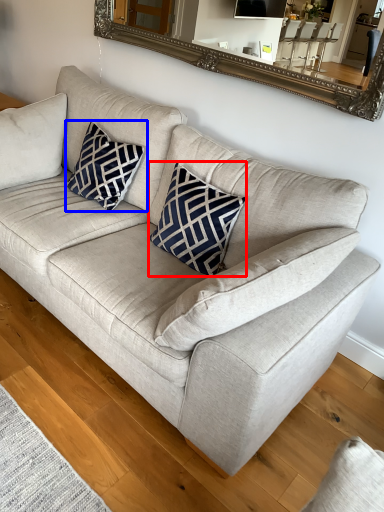
Question: Which object is closer to the camera taking this photo, throw pillow (highlighted by a red box) or pillow (highlighted by a blue box)?

Choices:
 (A) throw pillow
 (B) pillow

Answer: (A)